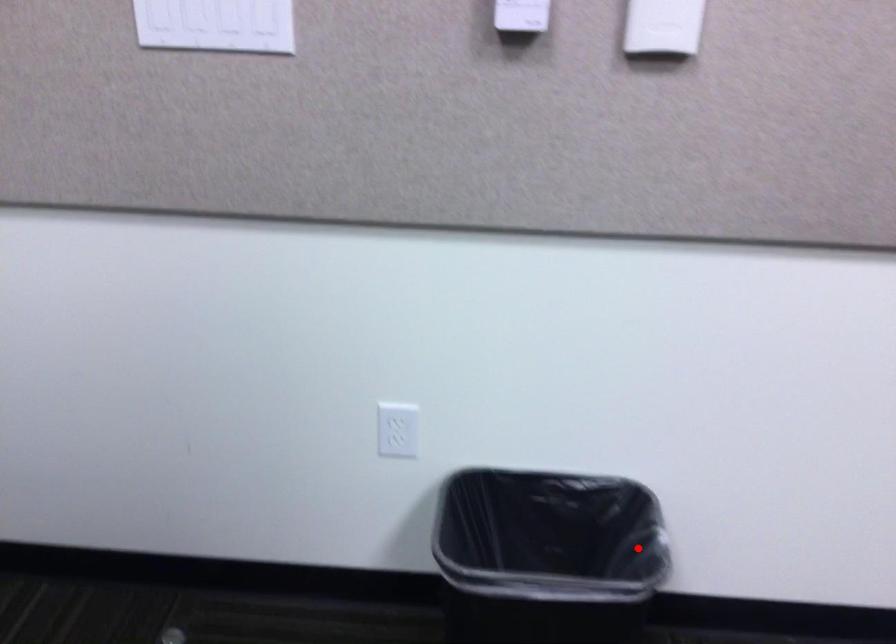
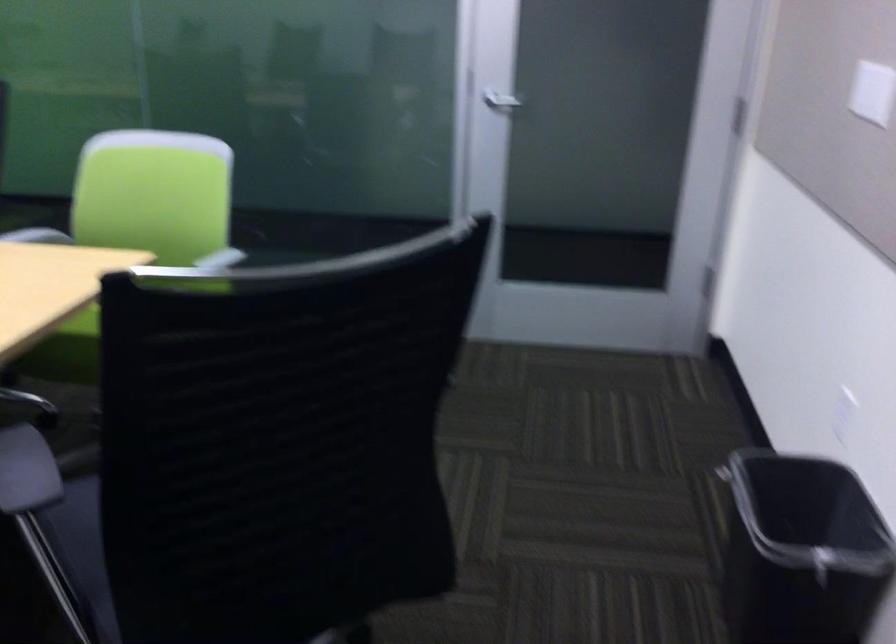
Question: I am providing you with two images of the same scene from different viewpoints. Image1 has a red point marked. In image2, the corresponding 3D location appears at what relative position? Reply with the corresponding letter.

Choices:
 (A) Closer
 (B) Farther

Answer: (B)